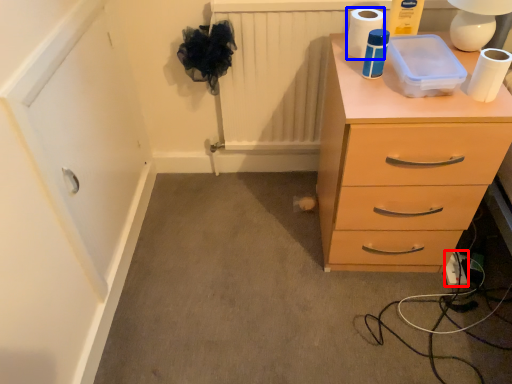
Question: Which of the following is the closest to the observer, extension cord (highlighted by a red box) or toilet paper (highlighted by a blue box)?

Choices:
 (A) extension cord
 (B) toilet paper

Answer: (B)